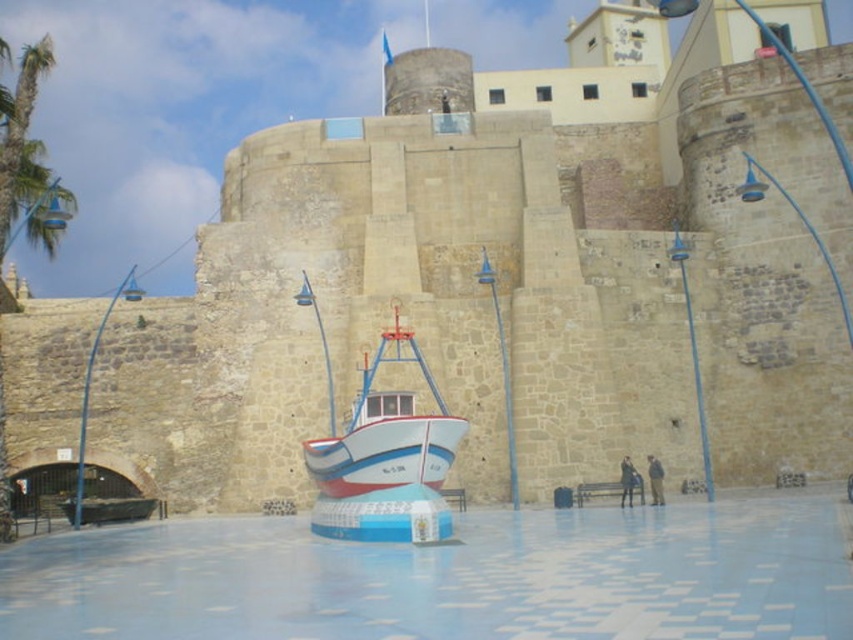
Does white glossy boat at center appear over green leafy palm tree at upper left?

No.

The image size is (853, 640). What do you see at coordinates (381, 428) in the screenshot?
I see `white glossy boat at center` at bounding box center [381, 428].

Between point (439, 456) and point (4, 180), which one is positioned in front?

Positioned in front is point (439, 456).

Identify the location of white glossy boat at center. (381, 428).